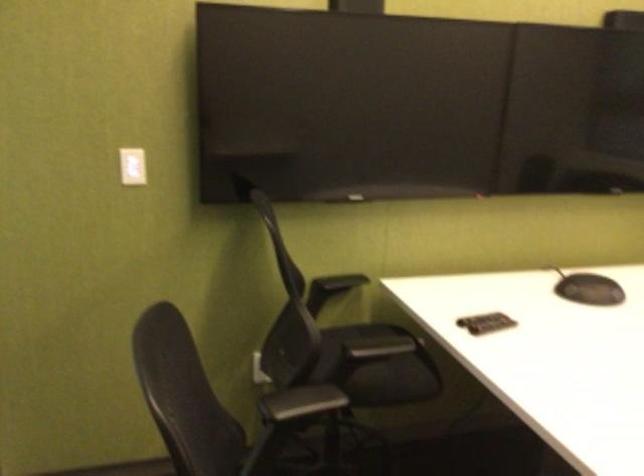
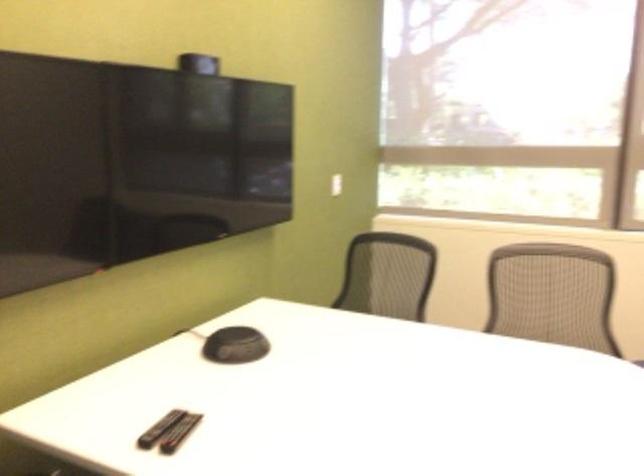
Question: The camera is either moving clockwise (left) or counter-clockwise (right) around the object. The first image is from the beginning of the video and the second image is from the end. Is the camera moving left or right when shooting the video?

Choices:
 (A) Left
 (B) Right

Answer: (A)